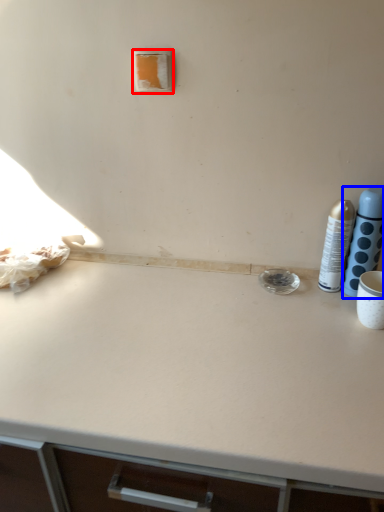
Question: Which point is further to the camera, light switch (highlighted by a red box) or bottle (highlighted by a blue box)?

Choices:
 (A) light switch
 (B) bottle

Answer: (A)